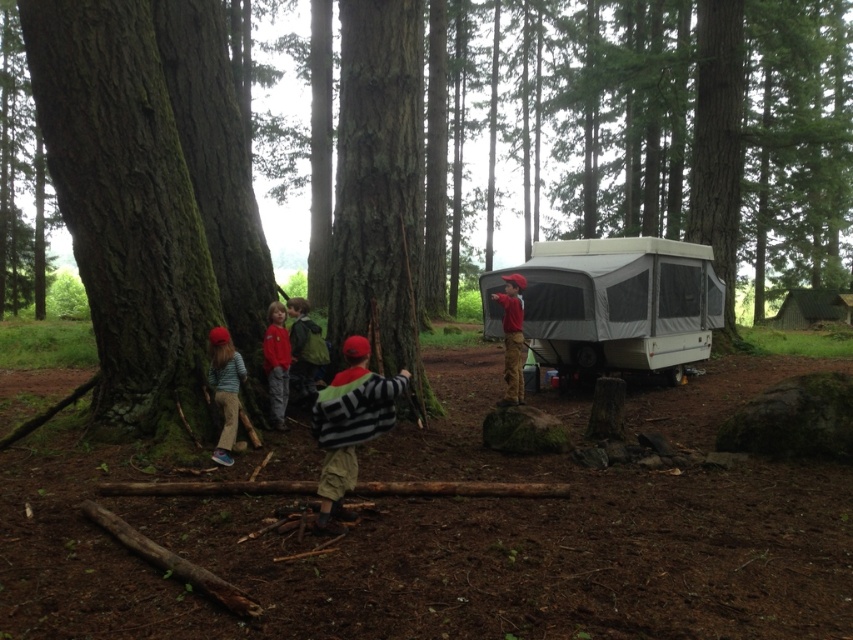
Can you confirm if white mesh recreational vehicle at right is positioned to the left of green backpack at center?

In fact, white mesh recreational vehicle at right is to the right of green backpack at center.

Which of these two, white mesh recreational vehicle at right or green backpack at center, stands taller?

white mesh recreational vehicle at right

Is point (647, 344) farther from camera compared to point (292, 312)?

Yes, point (647, 344) is behind point (292, 312).

I want to click on white mesh recreational vehicle at right, so click(x=621, y=305).

Is point (834, 150) positioned behind point (339, 476)?

Yes, it is behind point (339, 476).

I want to click on green rough bark tree at center, so click(x=688, y=129).

Which is in front, point (527, 61) or point (334, 449)?

Point (334, 449) is in front.

This screenshot has width=853, height=640. What are the coordinates of `green rough bark tree at center` in the screenshot? It's located at (688, 129).

How far apart are striped sweater at left and matte red shirt at center?

The distance of striped sweater at left from matte red shirt at center is 31.25 inches.

Between point (219, 390) and point (277, 353), which one is positioned behind?

Positioned behind is point (277, 353).

The width and height of the screenshot is (853, 640). I want to click on striped sweater at left, so click(224, 388).